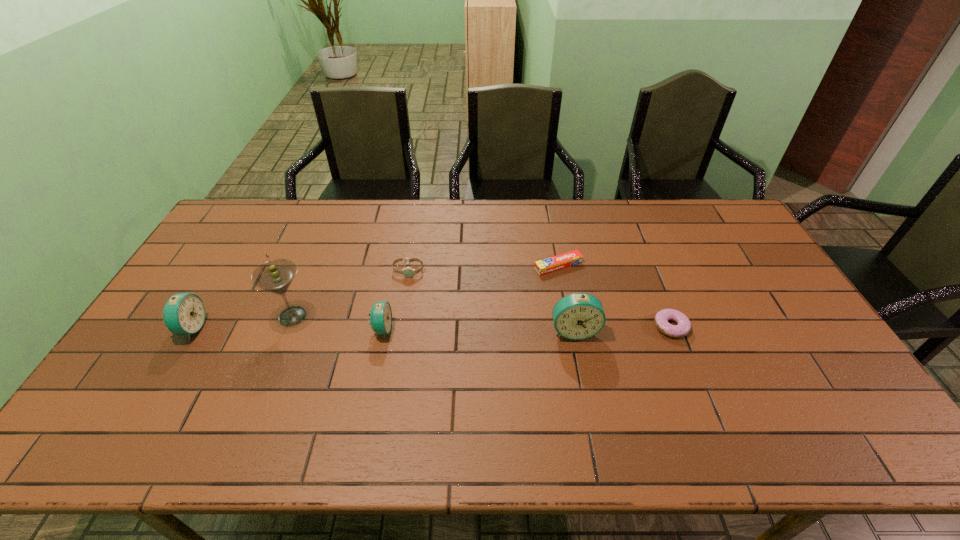
At what (x,y) coordinates should I click in order to perform the action: click on vacant area that lies between the sixth object from right to left and the toothpaste. Please return your answer as a coordinate pair (x, y). Looking at the image, I should click on (425, 291).

Find the location of `free spot between the third shortest object and the toothpaste`. free spot between the third shortest object and the toothpaste is located at coordinates (483, 268).

You are a GUI agent. You are given a task and a screenshot of the screen. Output one action in this format:
    pyautogui.click(x=<x>, y=<y>)
    Task: Click on the unoccupied position between the rightmost object and the shortest alarm clock
    The width and height of the screenshot is (960, 540).
    Given the screenshot: What is the action you would take?
    pyautogui.click(x=527, y=328)

At what (x,y) coordinates should I click in order to perform the action: click on free spot between the shortest alarm clock and the third shortest object. Please return your answer as a coordinate pair (x, y). Looking at the image, I should click on (396, 300).

In order to click on empty location between the second alarm clock from right to left and the toothpaste in this screenshot , I will do (470, 297).

The height and width of the screenshot is (540, 960). Identify the location of object that is the nearest to the rightmost alarm clock. (683, 326).

Locate which object is the closest to the toothpaste. Please provide its 2D coordinates. Your answer should be formatted as a tuple, i.e. [(x, y)], where the tuple contains the x and y coordinates of a point satisfying the conditions above.

[(577, 316)]

Locate an element on the screen. The image size is (960, 540). alarm clock that is the second closest to the sixth object from right to left is located at coordinates (380, 315).

I want to click on the third closest alarm clock to the doughnut, so click(184, 313).